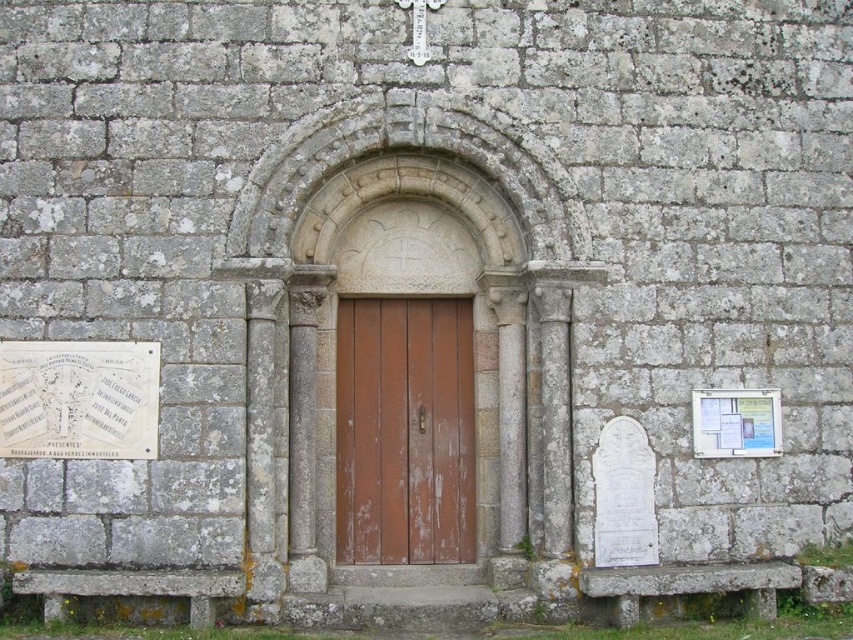
You are a painter who needs to move a ladder from the rusty wood door at center to the white paper at center. The ladder is 4 meters long. Can you move it horizontally without tilting it?

The rusty wood door at center and white paper at center are 4.89 meters apart from each other. Since the ladder is 4 meters long, it is shorter than the distance between them. Therefore, the ladder cannot reach from the rusty wood door at center to the white paper at center without tilting.

You are a visitor at the historic stone building entrance. You see a white paper plaque at lower left and a white paper at center. Which one is positioned more to the left side of the entrance?

Answer: The white paper plaque at lower left is positioned more to the left side of the entrance than the white paper at center.

You are a tour guide leading a group to the entrance of a historic building. You want to ensure that your group can easily see both the rusty wood door at center and the white paper plaque at lower left from their current position. Given that the average human field of view is about 180 degrees, can they see both objects without moving their heads?

The rusty wood door at center and the white paper plaque at lower left are 4.64 meters apart. Since the average human field of view spans 180 degrees, which is a wide angle, the 4.64 meter distance between the two objects would likely fall within this range. Therefore, the group can see both objects without moving their heads.